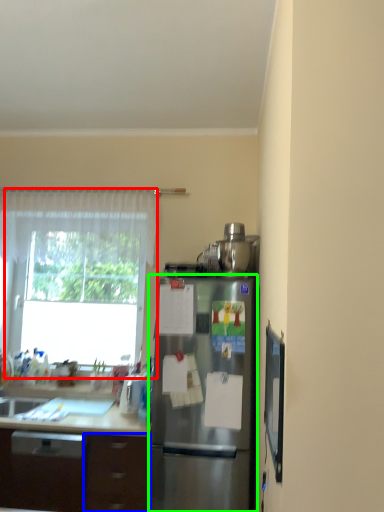
Question: Which is farther away from window (highlighted by a red box)? drawer (highlighted by a blue box) or refrigerator (highlighted by a green box)?

Choices:
 (A) drawer
 (B) refrigerator

Answer: (B)